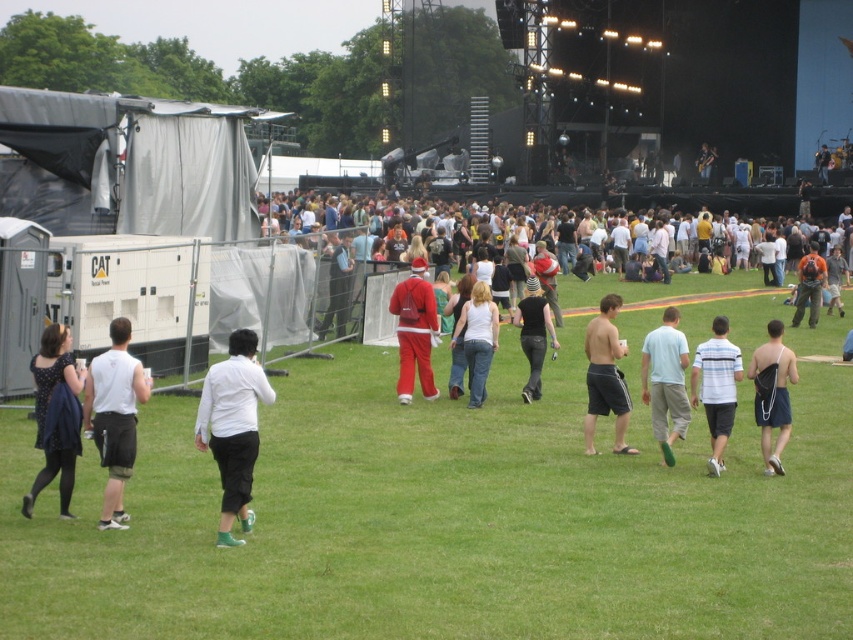
You are a photographer positioned at the camera location. You want to capture a clear photo of the white matte shirt at center. Considering the distance, will the shirt be in focus if your camera has a maximum focus range of 10 meters?

The white matte shirt at center is 10.97 meters away from the camera, which exceeds the camera maximum focus range of 10 meters. Therefore, the shirt will not be in focus.

You are a photographer at the music festival. You want to take a photo of the white matte shirt at center from a distance of 5 meters. Can you estimate the coordinates where you should position yourself to capture the shirt in the center of your photo?

To capture the white matte shirt at center in the center of your photo from 5 meters away, position yourself at coordinates approximately 0.669 on the x and 0.274 on the y axis, as the shirt is located at those coordinates.